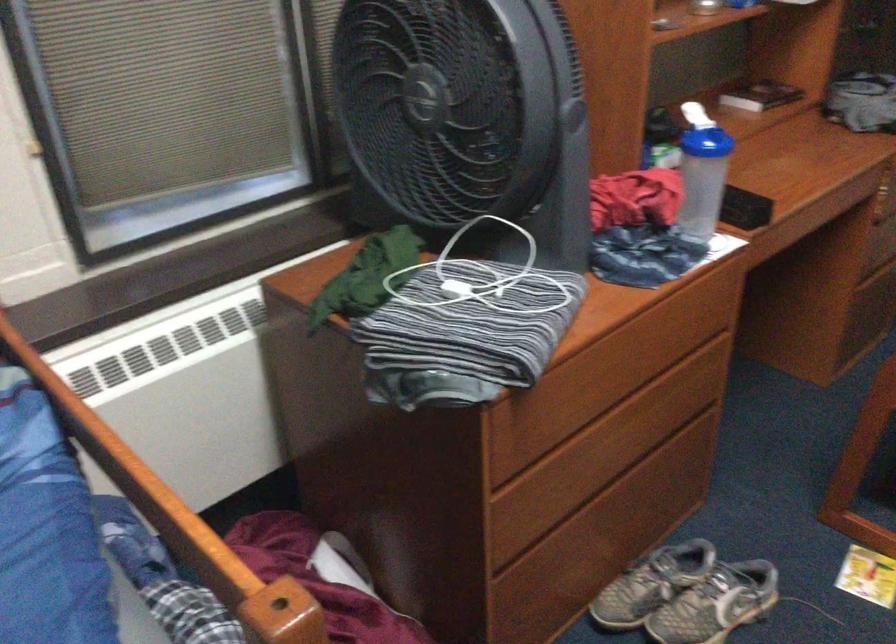
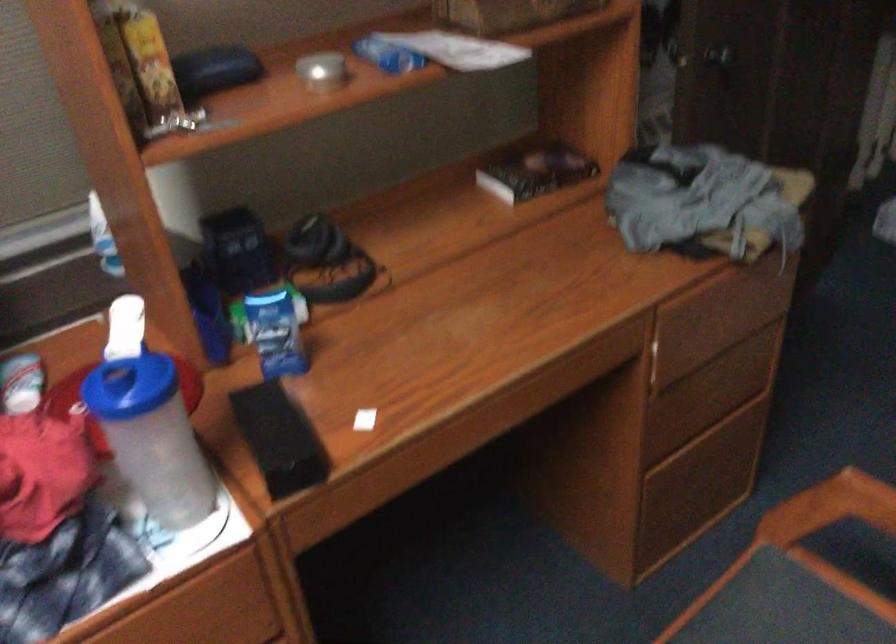
Locate, in the second image, the point that corresponds to (x=745, y=198) in the first image.

(279, 438)